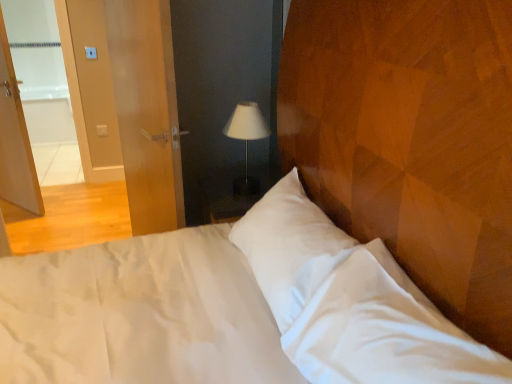
I want to click on vacant area that lies in front of white fabric lampshade at center, so click(233, 205).